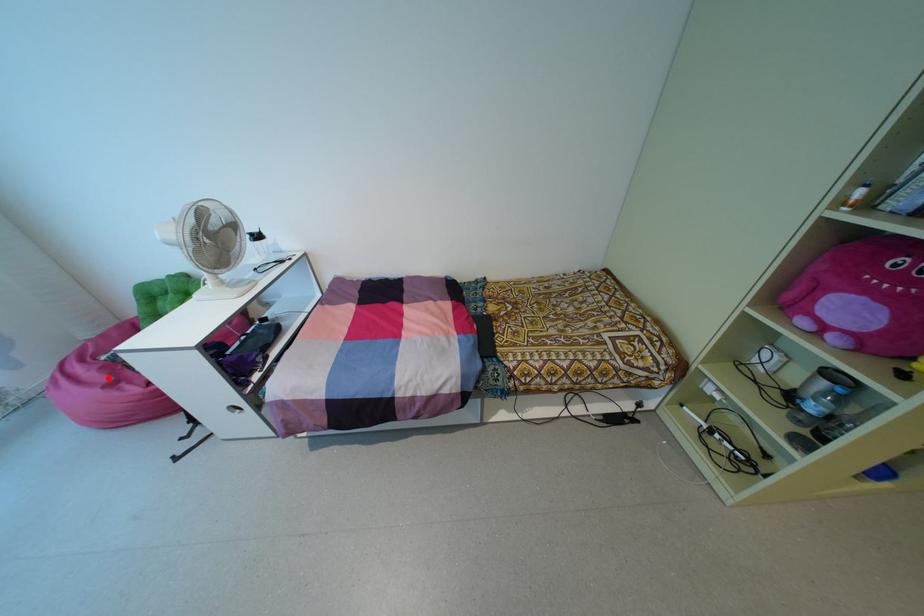
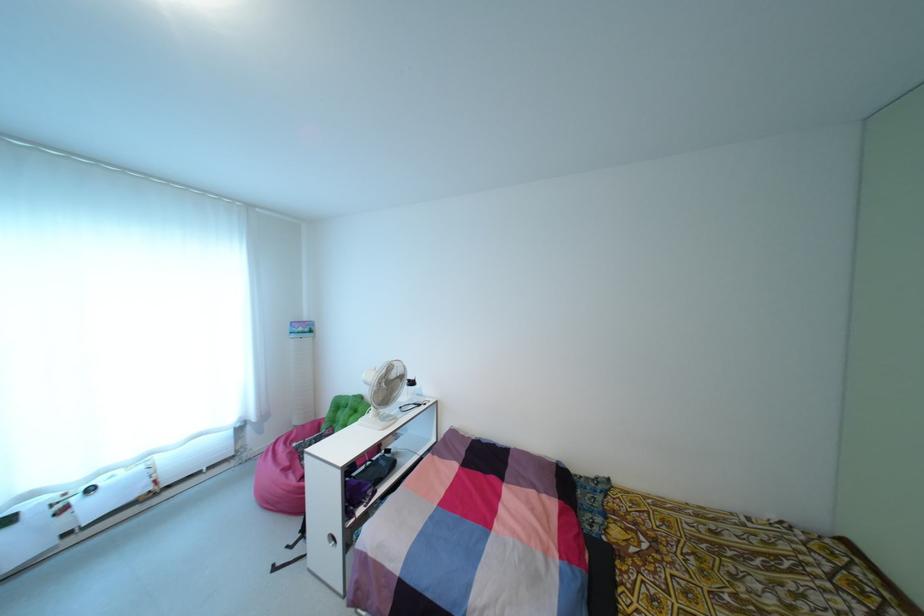
Question: I am providing you with two images of the same scene from different viewpoints. In image1, a red point is highlighted. Considering the same 3D point in image2, which of the following is correct?

Choices:
 (A) It is closer
 (B) It is farther

Answer: (B)